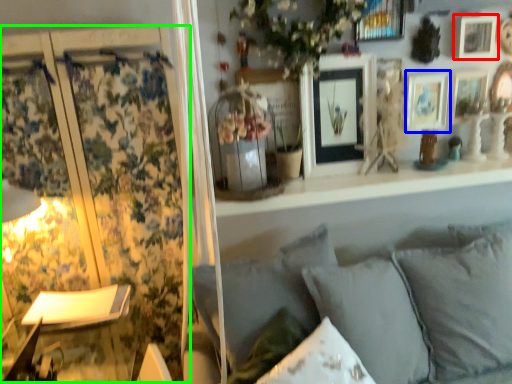
Question: Estimate the real-world distances between objects in this image. Which object is farther from picture frame (highlighted by a red box), picture frame (highlighted by a blue box) or curtain (highlighted by a green box)?

Choices:
 (A) picture frame
 (B) curtain

Answer: (B)